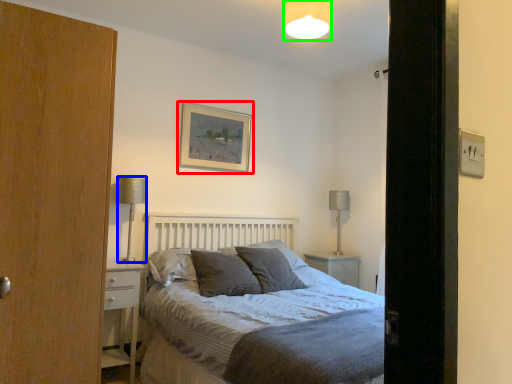
Question: Which is nearer to the picture frame (highlighted by a red box)? table lamp (highlighted by a blue box) or light fixture (highlighted by a green box).

Choices:
 (A) table lamp
 (B) light fixture

Answer: (A)